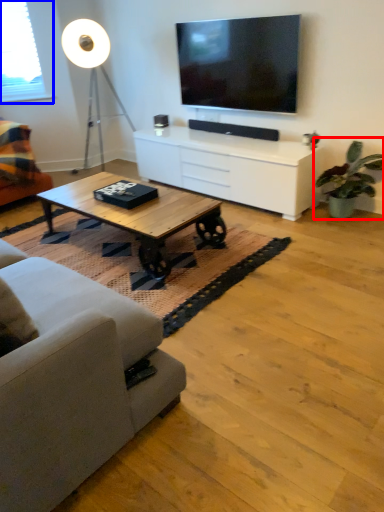
Question: Which object is further to the camera taking this photo, houseplant (highlighted by a red box) or window screen (highlighted by a blue box)?

Choices:
 (A) houseplant
 (B) window screen

Answer: (B)